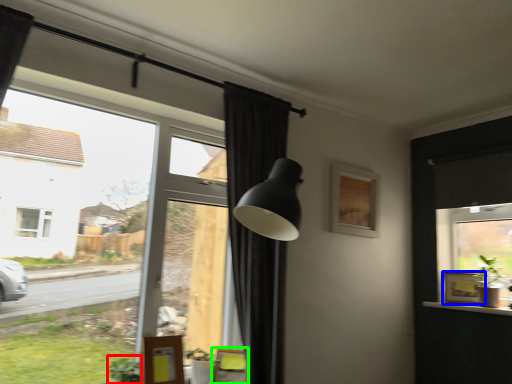
Question: Based on their relative distances, which object is farther from plant (highlighted by a red box)? Choose from picture frame (highlighted by a blue box) and swivel chair (highlighted by a green box).

Choices:
 (A) picture frame
 (B) swivel chair

Answer: (A)